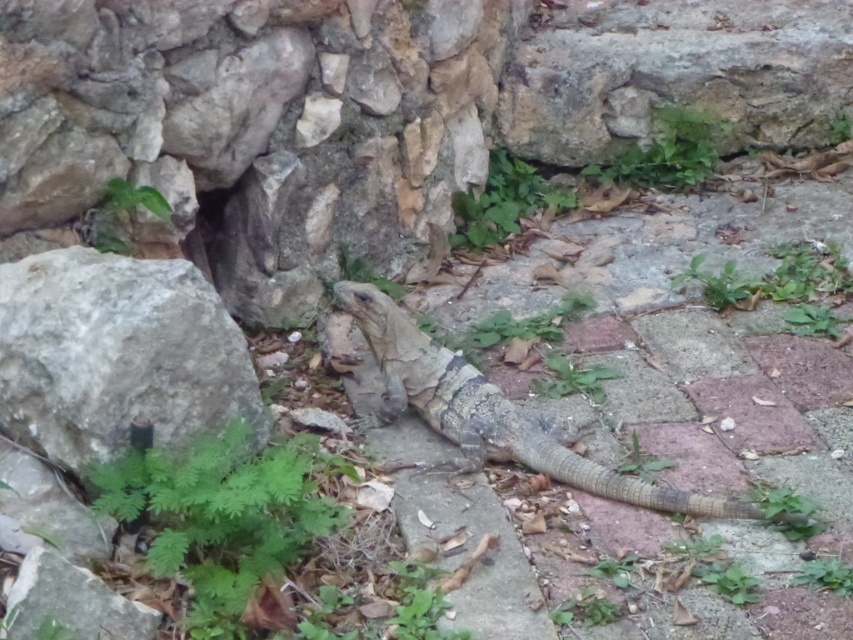
Measure the distance between point (70, 406) and camera.

Point (70, 406) and camera are 6.62 feet apart from each other.

Between gray rough rock at left and leathery brown lizard at center, which one has more height?

leathery brown lizard at center is taller.

Between point (106, 323) and point (656, 499), which one is positioned behind?

The point (656, 499) is behind.

Identify the location of gray rough rock at left. (117, 355).

Measure the distance between leathery brown iguana at center and camera.

leathery brown iguana at center is 6.34 feet away from camera.

Can you confirm if leathery brown iguana at center is positioned to the right of leathery brown lizard at center?

Yes, leathery brown iguana at center is to the right of leathery brown lizard at center.

You are a GUI agent. You are given a task and a screenshot of the screen. Output one action in this format:
    pyautogui.click(x=<x>, y=<y>)
    Task: Click on the leathery brown iguana at center
    
    Given the screenshot: What is the action you would take?
    pyautogui.click(x=688, y=400)

Is leathery brown iguana at center smaller than gray rough rock at left?

No.

Locate an element on the screen. The height and width of the screenshot is (640, 853). leathery brown iguana at center is located at coordinates (688, 400).

Is point (825, 600) farther from viewer compared to point (85, 257)?

No, (825, 600) is in front of (85, 257).

At what (x,y) coordinates should I click in order to perform the action: click on leathery brown iguana at center. Please return your answer as a coordinate pair (x, y). The width and height of the screenshot is (853, 640). Looking at the image, I should click on [x=688, y=400].